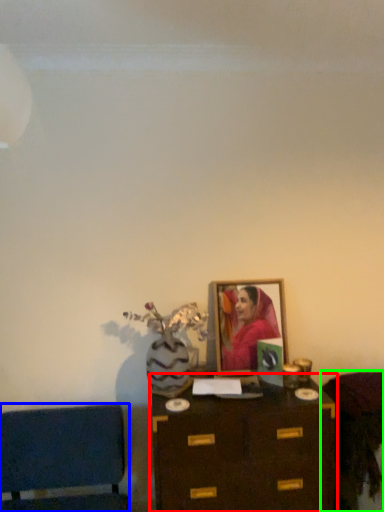
Question: Estimate the real-world distances between objects in this image. Which object is farther from table (highlighted by a red box), furniture (highlighted by a blue box) or furniture (highlighted by a green box)?

Choices:
 (A) furniture
 (B) furniture

Answer: (A)